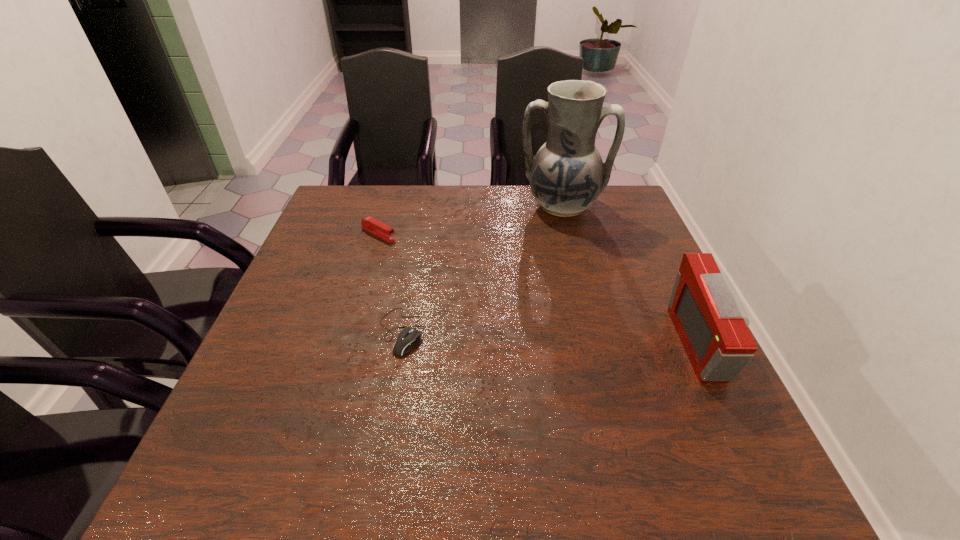
This screenshot has height=540, width=960. I want to click on the second object from left to right, so click(x=408, y=337).

Locate an element on the screen. the shortest object is located at coordinates (408, 337).

Where is `camera`? This screenshot has width=960, height=540. camera is located at coordinates (710, 320).

Identify the location of the third shortest object. This screenshot has width=960, height=540. pyautogui.click(x=710, y=320).

This screenshot has width=960, height=540. I want to click on pitcher, so click(x=567, y=175).

This screenshot has height=540, width=960. I want to click on the third object from left to right, so click(567, 175).

Image resolution: width=960 pixels, height=540 pixels. Identify the location of the leftmost object. (370, 224).

You are a GUI agent. You are given a task and a screenshot of the screen. Output one action in this format:
    pyautogui.click(x=<x>, y=<y>)
    Task: Click on the stapler
    The height and width of the screenshot is (540, 960).
    Given the screenshot: What is the action you would take?
    pyautogui.click(x=370, y=224)

This screenshot has width=960, height=540. Find the location of `free spot located 0.280m on the right of the computer mouse`. free spot located 0.280m on the right of the computer mouse is located at coordinates (553, 332).

Find the location of a particular element. Image resolution: width=960 pixels, height=540 pixels. vacant position located on the front-facing side of the third object from left to right is located at coordinates click(548, 283).